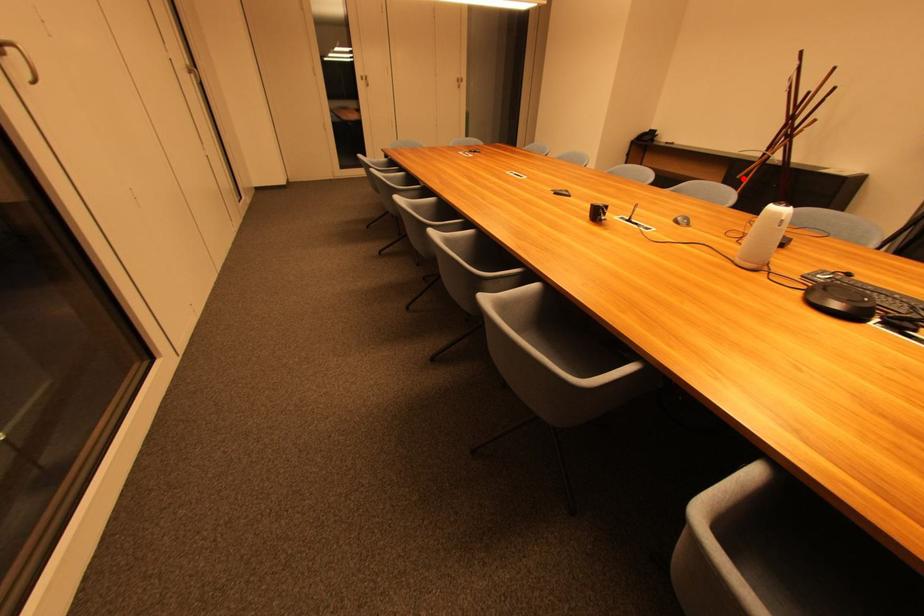
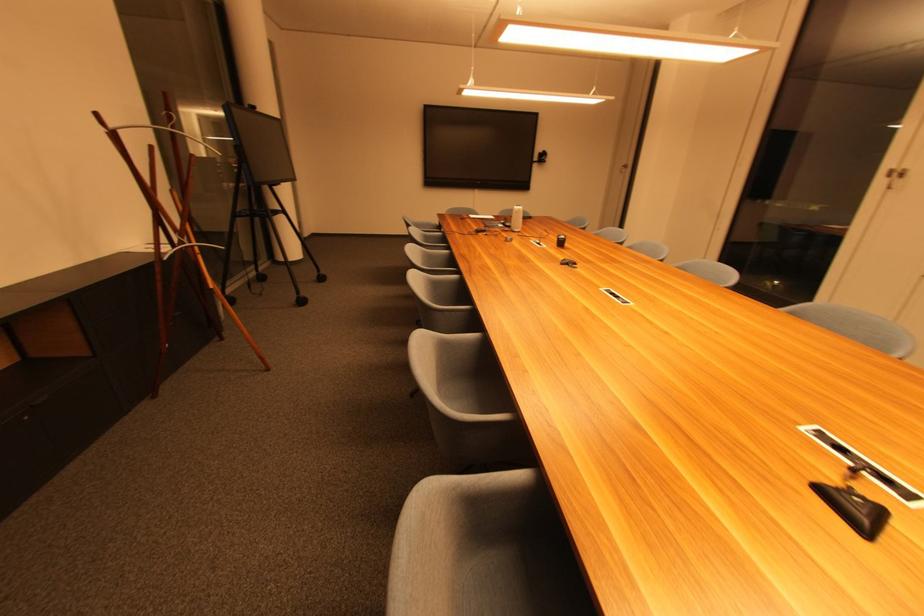
Question: A red point is marked in image1. In image2, is the corresponding 3D point closer to the camera or farther? Reply with the corresponding letter.

Choices:
 (A) The corresponding 3D point is closer.
 (B) The corresponding 3D point is farther.

Answer: (A)